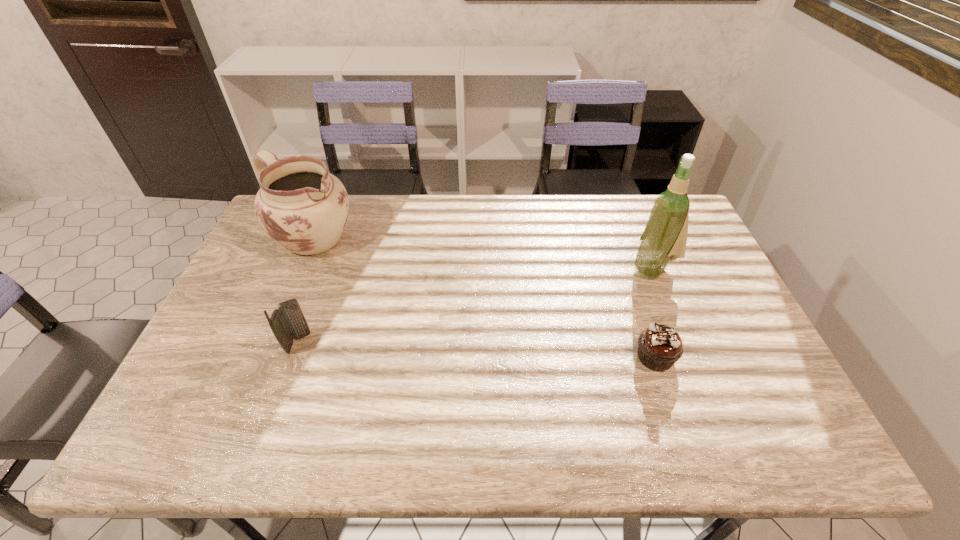
Image resolution: width=960 pixels, height=540 pixels. I want to click on the second shortest object, so click(287, 322).

At what (x,y) coordinates should I click in order to perform the action: click on cupcake. Please return your answer as a coordinate pair (x, y). This screenshot has height=540, width=960. Looking at the image, I should click on (659, 346).

Identify the location of the third shortest object. (300, 205).

Where is `the tallest object`? This screenshot has height=540, width=960. the tallest object is located at coordinates (664, 239).

This screenshot has width=960, height=540. I want to click on vacant space positioned on the keyboard of the cellular telephone, so click(x=389, y=343).

Find the location of a particular element. The height and width of the screenshot is (540, 960). free space located on the back of the shortest object is located at coordinates (626, 271).

Where is `free space located on the spout of the pitcher`? free space located on the spout of the pitcher is located at coordinates (372, 288).

The image size is (960, 540). In order to click on vacant space located 0.390m on the spout of the pitcher in this screenshot , I will do `click(418, 326)`.

Identify the location of free space located on the spout of the pitcher. The height and width of the screenshot is (540, 960). (357, 275).

Where is `free point located 0.400m on the front-facing side of the wine bottle`? free point located 0.400m on the front-facing side of the wine bottle is located at coordinates (531, 333).